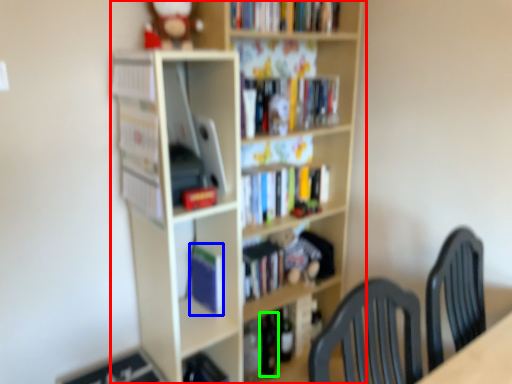
Question: Which object is positioned farthest from bookcase (highlighted by a red box)? Select from paperback book (highlighted by a blue box) and wine bottle (highlighted by a green box).

Choices:
 (A) paperback book
 (B) wine bottle

Answer: (B)